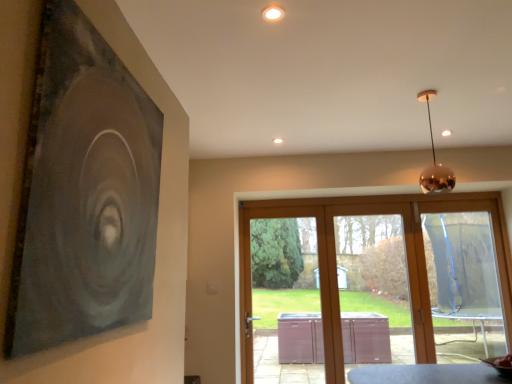
This screenshot has height=384, width=512. In order to click on copper metallic sphere at upper right in this screenshot , I will do `click(434, 161)`.

Measure the distance between transparent glass door at center and camera.

A distance of 3.29 meters exists between transparent glass door at center and camera.

The image size is (512, 384). Find the location of `copper metallic sphere at upper right`. copper metallic sphere at upper right is located at coordinates (434, 161).

Would you say transparent plastic screen at right is part of transparent plastic screen door at center's contents?

No, transparent plastic screen at right is not inside transparent plastic screen door at center.

Looking at the image, does transparent plastic screen door at center seem bigger or smaller compared to transparent plastic screen at right?

Clearly, transparent plastic screen door at center is smaller in size than transparent plastic screen at right.

Is transparent plastic screen door at center facing away from transparent plastic screen at right?

No, transparent plastic screen door at center is not facing away from transparent plastic screen at right.

Considering the sizes of objects transparent plastic screen door at center and transparent plastic screen at right in the image provided, who is wider, transparent plastic screen door at center or transparent plastic screen at right?

With larger width is transparent plastic screen at right.

Considering the points (446, 352) and (407, 313), which point is behind, point (446, 352) or point (407, 313)?

The point (407, 313) is behind.

Considering the positions of objects transparent glass door at center and transparent plastic screen door at center in the image provided, who is more to the right, transparent glass door at center or transparent plastic screen door at center?

Positioned to the right is transparent glass door at center.

From the picture: From the image's perspective, which object appears higher, transparent glass door at center or transparent plastic screen door at center?

transparent plastic screen door at center.

Is white glossy light fixture at upper center far from transparent glass door at center?

Yes.

Is white glossy light fixture at upper center positioned with its back to transparent glass door at center?

That's not correct — white glossy light fixture at upper center is not looking away from transparent glass door at center.

Is white glossy light fixture at upper center further to camera compared to transparent glass door at center?

No.

Based on the photo, in terms of width, does matte black painting at upper left look wider or thinner when compared to transparent glass door at center?

Considering their sizes, matte black painting at upper left looks slimmer than transparent glass door at center.

Between matte black painting at upper left and transparent glass door at center, which one has less height?

matte black painting at upper left.

From the image's perspective, between matte black painting at upper left and transparent glass door at center, which one is located above?

From the image's view, matte black painting at upper left is above.

Can you tell me how much matte black painting at upper left and transparent glass door at center differ in facing direction?

There is a 87.8-degree angle between the facing directions of matte black painting at upper left and transparent glass door at center.

From a real-world perspective, which is physically below, transparent plastic screen at right or transparent glass door at center?

transparent glass door at center, from a real-world perspective.

Looking at the image, does transparent plastic screen at right seem bigger or smaller compared to transparent glass door at center?

Considering their sizes, transparent plastic screen at right takes up less space than transparent glass door at center.

From the picture: From the image's perspective, which one is positioned lower, transparent plastic screen at right or transparent glass door at center?

transparent glass door at center.

Based on their positions, is transparent glass door at center located to the left or right of matte black painting at upper left?

From the image, it's evident that transparent glass door at center is to the right of matte black painting at upper left.

How far apart are transparent glass door at center and matte black painting at upper left?

The distance of transparent glass door at center from matte black painting at upper left is 8.77 feet.

From a real-world perspective, is transparent glass door at center below matte black painting at upper left?

Correct, in the physical world, transparent glass door at center is lower than matte black painting at upper left.

Considering the relative positions of transparent glass door at center and matte black painting at upper left in the image provided, is transparent glass door at center behind matte black painting at upper left?

Yes, the depth of transparent glass door at center is greater than that of matte black painting at upper left.

Which is in front, point (456, 303) or point (339, 260)?

The point (456, 303) is closer.

Considering the relative positions of transparent plastic screen at right and transparent plastic screen door at center in the image provided, is transparent plastic screen at right in front of transparent plastic screen door at center?

Yes.

The image size is (512, 384). Identify the location of screen door that is behind the transparent plastic screen at right. (368, 280).

Where is `window screen that appears on the right of transparent plastic screen door at center`? window screen that appears on the right of transparent plastic screen door at center is located at coordinates (463, 263).

Image resolution: width=512 pixels, height=384 pixels. In order to click on screen door above the transparent glass door at center (from a real-world perspective) in this screenshot , I will do `click(368, 280)`.

Estimate the real-world distances between objects in this image. Which object is closer to copper metallic sphere at upper right, white glossy light fixture at upper center or matte black painting at upper left?

Among the two, white glossy light fixture at upper center is located nearer to copper metallic sphere at upper right.

Estimate the real-world distances between objects in this image. Which object is closer to transparent glass door at center, matte black painting at upper left or copper metallic sphere at upper right?

The object closer to transparent glass door at center is copper metallic sphere at upper right.

From the image, which object appears to be nearer to white glossy light fixture at upper center, transparent plastic screen at right or matte black painting at upper left?

matte black painting at upper left is closer to white glossy light fixture at upper center.

Based on their spatial positions, is transparent plastic screen at right or white glossy light fixture at upper center further from matte black painting at upper left?

transparent plastic screen at right.

From the image, which object appears to be nearer to copper metallic sphere at upper right, matte black painting at upper left or transparent plastic screen door at center?

matte black painting at upper left is closer to copper metallic sphere at upper right.

Based on their spatial positions, is transparent plastic screen door at center or transparent glass door at center closer to matte black painting at upper left?

transparent glass door at center.

Considering their positions, is transparent glass door at center positioned further to transparent plastic screen door at center than transparent plastic screen at right?

The object further to transparent plastic screen door at center is transparent glass door at center.

Looking at the image, which one is located further to matte black painting at upper left, transparent glass door at center or white glossy light fixture at upper center?

transparent glass door at center is positioned further to the anchor matte black painting at upper left.

Identify the location of lighting between matte black painting at upper left and copper metallic sphere at upper right in the horizontal direction. (273, 13).

Where is `lighting between matte black painting at upper left and transparent plastic screen door at center in the front-back direction`? This screenshot has width=512, height=384. lighting between matte black painting at upper left and transparent plastic screen door at center in the front-back direction is located at coordinates pos(273,13).

Identify the location of window located between matte black painting at upper left and transparent plastic screen at right in the depth direction. (377, 280).

At what (x,y) coordinates should I click in order to perform the action: click on lamp located between white glossy light fixture at upper center and transparent glass door at center in the depth direction. Please return your answer as a coordinate pair (x, y). This screenshot has height=384, width=512. Looking at the image, I should click on (434, 161).